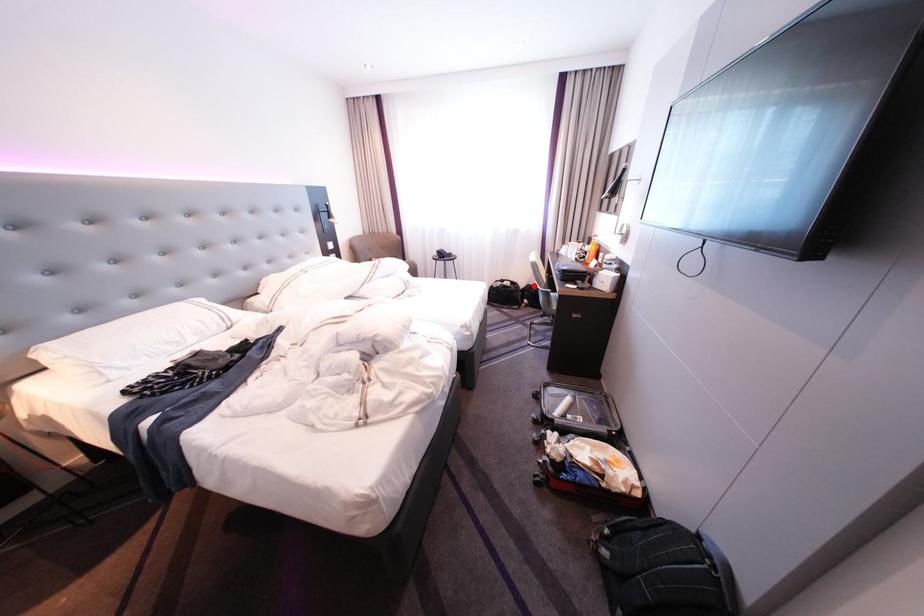
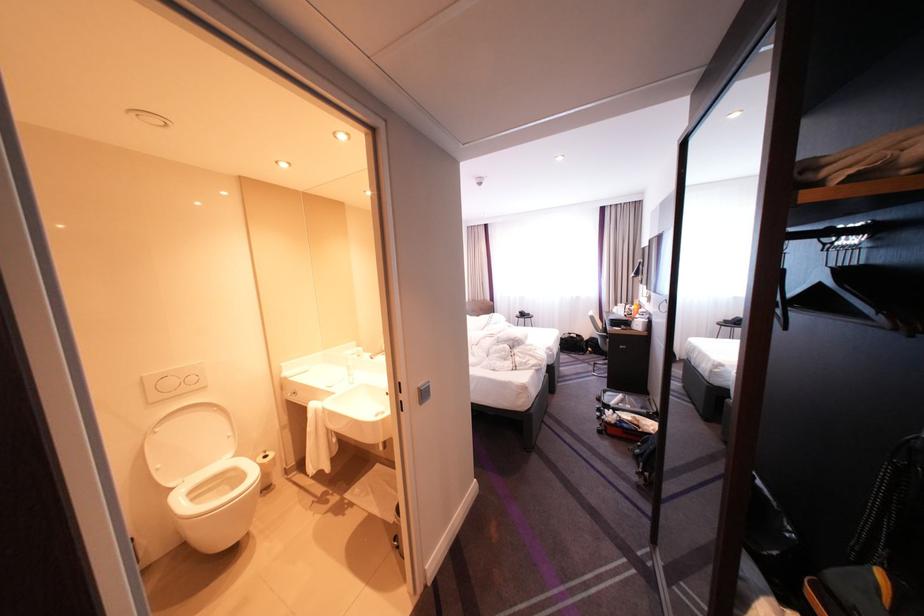
In the second image, find the point that corresponds to the highlighted location in the first image.

(599, 338)